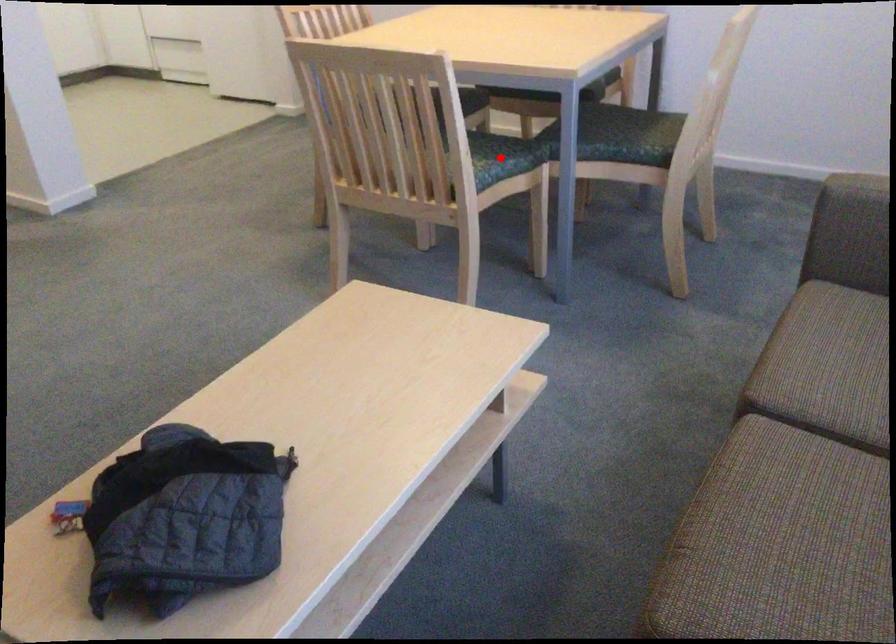
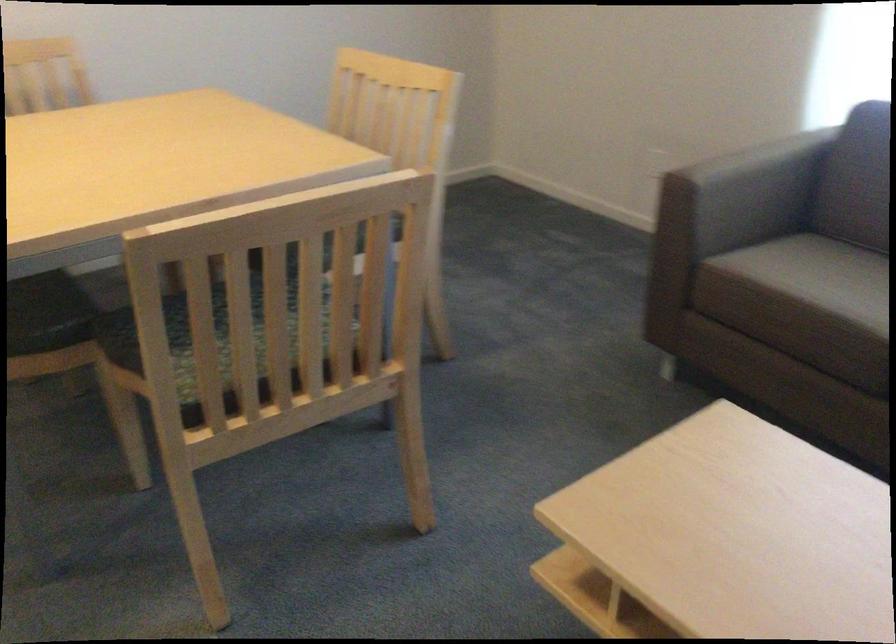
Question: I am providing you with two images of the same scene from different viewpoints. A red point is marked on the first image. Is the red point's position out of view in image 2?

Choices:
 (A) Yes
 (B) No

Answer: (A)